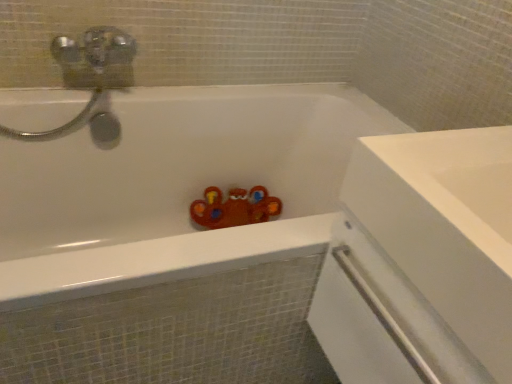
Question: From a real-world perspective, is clear plastic screen door at right over white glossy bathtub at center?

Choices:
 (A) yes
 (B) no

Answer: (A)

Question: Is clear plastic screen door at right at the right side of white glossy bathtub at center?

Choices:
 (A) yes
 (B) no

Answer: (A)

Question: Is clear plastic screen door at right thinner than white glossy bathtub at center?

Choices:
 (A) yes
 (B) no

Answer: (A)

Question: Would you say clear plastic screen door at right contains white glossy bathtub at center?

Choices:
 (A) no
 (B) yes

Answer: (A)

Question: Is clear plastic screen door at right oriented towards white glossy bathtub at center?

Choices:
 (A) no
 (B) yes

Answer: (A)

Question: Can you confirm if clear plastic screen door at right is taller than white glossy bathtub at center?

Choices:
 (A) no
 (B) yes

Answer: (A)

Question: From a real-world perspective, is white glossy bathtub at center under clear plastic screen door at right?

Choices:
 (A) yes
 (B) no

Answer: (A)

Question: Would you say white glossy bathtub at center is outside clear plastic screen door at right?

Choices:
 (A) yes
 (B) no

Answer: (A)

Question: Is white glossy bathtub at center next to clear plastic screen door at right and touching it?

Choices:
 (A) yes
 (B) no

Answer: (B)

Question: Would you consider white glossy bathtub at center to be distant from clear plastic screen door at right?

Choices:
 (A) yes
 (B) no

Answer: (B)

Question: From the image's perspective, is white glossy bathtub at center under clear plastic screen door at right?

Choices:
 (A) no
 (B) yes

Answer: (A)

Question: Is white glossy bathtub at center looking in the opposite direction of clear plastic screen door at right?

Choices:
 (A) no
 (B) yes

Answer: (A)

Question: Is point (30, 248) closer or farther from the camera than point (412, 322)?

Choices:
 (A) closer
 (B) farther

Answer: (B)